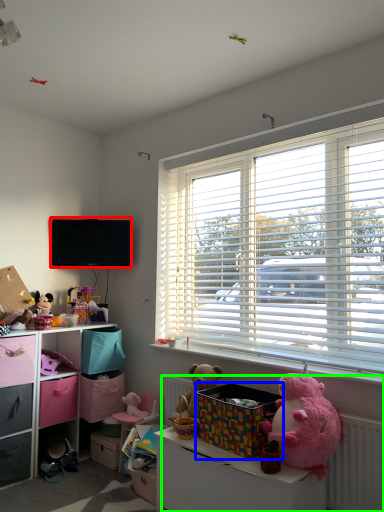
Question: Which object is positioned farthest from television (highlighted by a red box)? Select from storage box (highlighted by a blue box) and radiator (highlighted by a green box).

Choices:
 (A) storage box
 (B) radiator

Answer: (B)